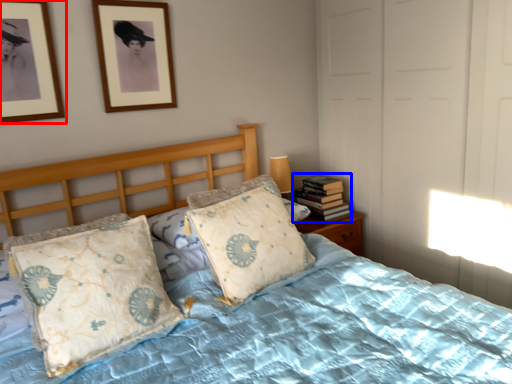
Question: Which point is further to the camera, picture frame (highlighted by a red box) or book (highlighted by a blue box)?

Choices:
 (A) picture frame
 (B) book

Answer: (B)